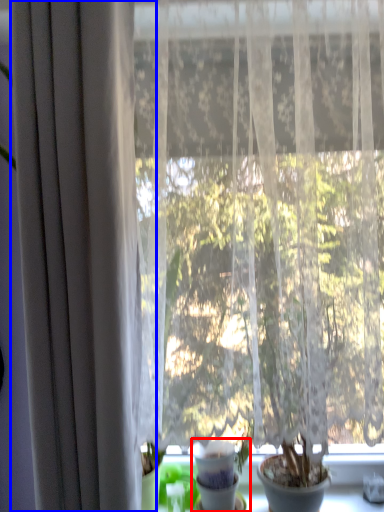
Question: Which of the following is the farthest to the observer, houseplant (highlighted by a red box) or curtain (highlighted by a blue box)?

Choices:
 (A) houseplant
 (B) curtain

Answer: (A)